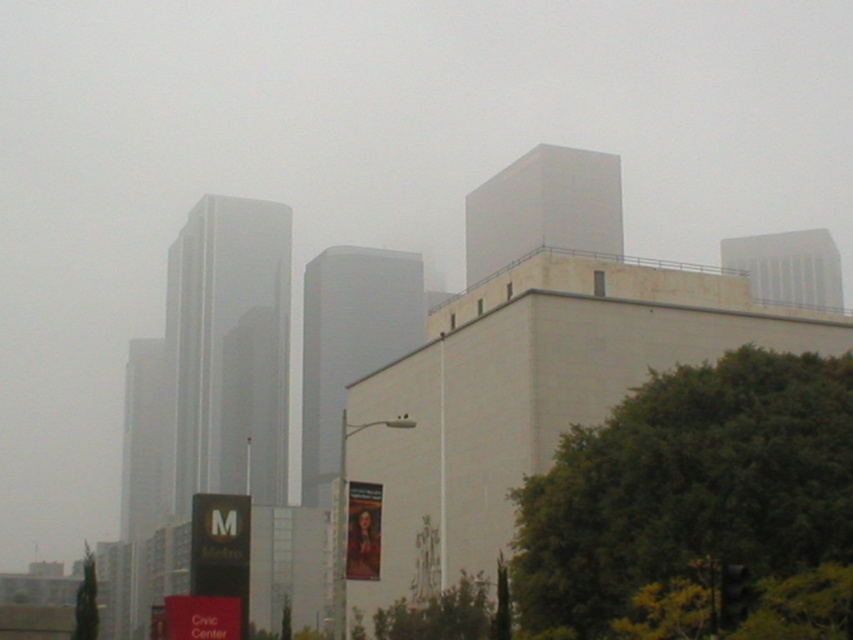
Question: Considering the real-world distances, which object is farthest from the green leafy tree at lower right?

Choices:
 (A) black matte traffic light at lower right
 (B) green leafy tree at lower left

Answer: (B)

Question: Which object appears closest to the camera in this image?

Choices:
 (A) black matte traffic light at lower right
 (B) green leafy tree at lower right
 (C) green leafy tree at lower left

Answer: (A)

Question: Does green leafy tree at lower left come in front of black matte traffic light at lower right?

Choices:
 (A) yes
 (B) no

Answer: (B)

Question: Observing the image, what is the correct spatial positioning of green leafy tree at lower right in reference to black matte traffic light at lower right?

Choices:
 (A) right
 (B) left

Answer: (A)

Question: Does green leafy tree at lower right have a larger size compared to green leafy tree at lower left?

Choices:
 (A) no
 (B) yes

Answer: (A)

Question: Which object is farther from the camera taking this photo?

Choices:
 (A) green leafy tree at lower right
 (B) black matte traffic light at lower right

Answer: (A)